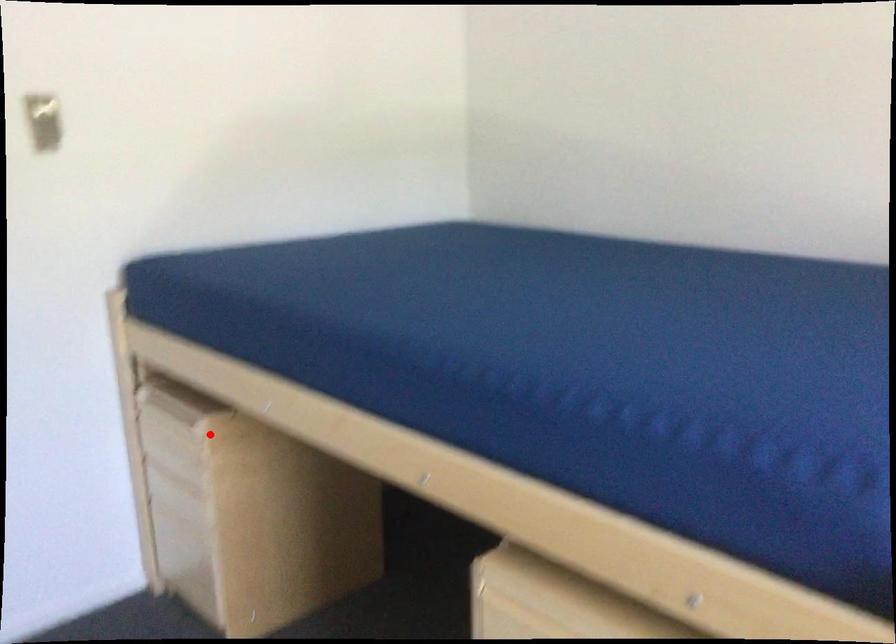
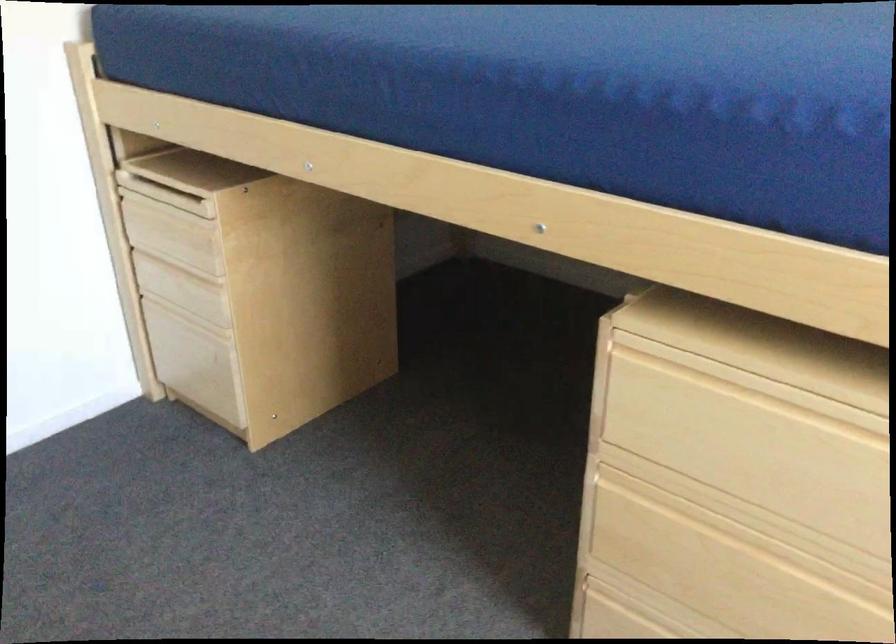
Locate, in the second image, the point that corresponds to the highlighted location in the first image.

(220, 214)